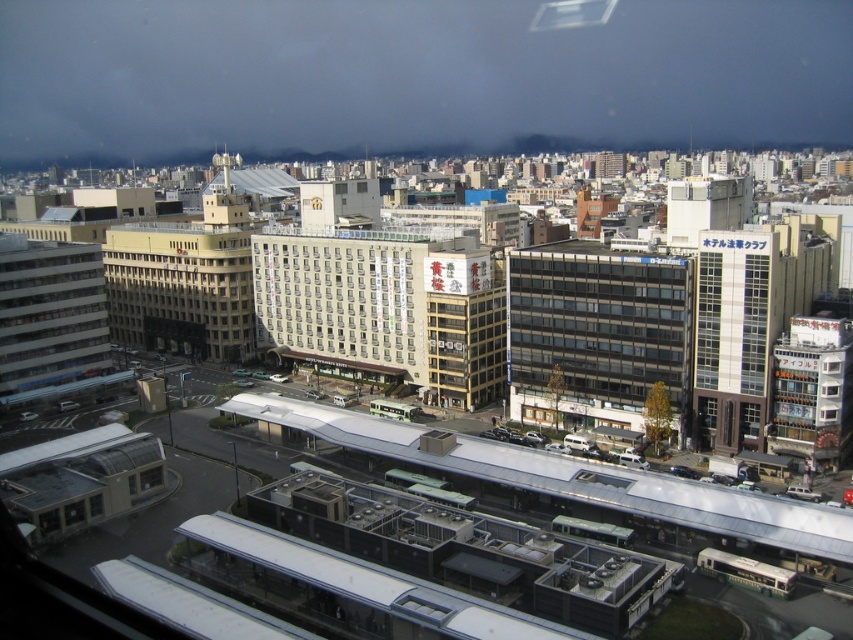
Can you confirm if white matte building at center is positioned below beige concrete building at center-left?

Yes.

Consider the image. Does white matte building at center have a larger size compared to beige concrete building at center-left?

No.

What are the coordinates of `white matte building at center` in the screenshot? It's located at click(340, 296).

Which is more to the left, matte glass building at center or white matte building at center?

From the viewer's perspective, white matte building at center appears more on the left side.

Measure the distance from matte glass building at center to white matte building at center.

matte glass building at center and white matte building at center are 35.03 meters apart.

Is point (595, 397) less distant than point (305, 298)?

Yes.

You are a GUI agent. You are given a task and a screenshot of the screen. Output one action in this format:
    pyautogui.click(x=<x>, y=<y>)
    Task: Click on the matte glass building at center
    This screenshot has width=853, height=640.
    Given the screenshot: What is the action you would take?
    pyautogui.click(x=598, y=323)

Which of these two, matte glass building at center or beige concrete building at center-left, stands taller?

With more height is beige concrete building at center-left.

This screenshot has width=853, height=640. What do you see at coordinates (598, 323) in the screenshot?
I see `matte glass building at center` at bounding box center [598, 323].

The height and width of the screenshot is (640, 853). Identify the location of matte glass building at center. (598, 323).